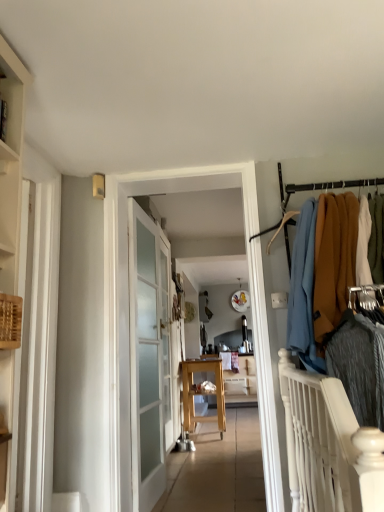
Measure the distance between wooden table at center and camera.

They are 5.89 meters apart.

Where is `matte glass door at center`? matte glass door at center is located at coordinates pyautogui.click(x=127, y=303).

Image resolution: width=384 pixels, height=512 pixels. What do you see at coordinates (127, 303) in the screenshot?
I see `matte glass door at center` at bounding box center [127, 303].

Image resolution: width=384 pixels, height=512 pixels. In order to click on blue woolen sweater at right in this screenshot , I will do `click(321, 273)`.

This screenshot has width=384, height=512. Describe the element at coordinates (328, 446) in the screenshot. I see `white wooden balustrade at lower right` at that location.

Describe the element at coordinates (218, 470) in the screenshot. The width and height of the screenshot is (384, 512). I see `wooden table at center` at that location.

What do you see at coordinates (149, 357) in the screenshot? I see `white frosted glass door at center` at bounding box center [149, 357].

Describe the element at coordinates (202, 393) in the screenshot. I see `wooden table at center` at that location.

Find the location of a particular element. This screenshot has width=384, height=512. wooden table at center is located at coordinates (202, 393).

You are a GUI agent. You are given a task and a screenshot of the screen. Output one action in this format:
    pyautogui.click(x=<x>, y=<y>)
    Task: Click on the wooden table at center
    The width and height of the screenshot is (384, 512).
    Given the screenshot: What is the action you would take?
    pyautogui.click(x=241, y=383)

Is wooden table at center oriented away from wooden table at center?

wooden table at center does not have its back to wooden table at center.

Is wooden table at center a part of wooden table at center?

Actually, wooden table at center is outside wooden table at center.

Is wooden table at center touching wooden table at center?

No, wooden table at center is not beside wooden table at center.

Is the surface of wooden table at center in direct contact with clear glass door at center?

No, wooden table at center is not with clear glass door at center.

Could you tell me if wooden table at center is facing clear glass door at center?

No, wooden table at center does not turn towards clear glass door at center.

Which of these two, wooden table at center or clear glass door at center, is wider?

With larger width is wooden table at center.

Between point (241, 448) and point (171, 435), which one is positioned behind?

Positioned behind is point (171, 435).

I want to click on cabinetry that appears on the left of white frosted glass door at center, so click(11, 164).

Is white frosted glass door at center oriented away from wooden shelf at left?

white frosted glass door at center does not have its back to wooden shelf at left.

Can you tell me how much white frosted glass door at center and wooden shelf at left differ in facing direction?

The angular difference between white frosted glass door at center and wooden shelf at left is 71.8 degrees.

From the image's perspective, is white frosted glass door at center under wooden shelf at left?

Yes, from the image's perspective, white frosted glass door at center is beneath wooden shelf at left.

Considering the positions of objects white wooden balustrade at lower right and wooden shelf at left in the image provided, who is behind, white wooden balustrade at lower right or wooden shelf at left?

wooden shelf at left is more distant.

Is white wooden balustrade at lower right wider or thinner than wooden shelf at left?

In the image, white wooden balustrade at lower right appears to be wider than wooden shelf at left.

From a real-world perspective, does white wooden balustrade at lower right stand above wooden shelf at left?

No, from a real-world perspective, white wooden balustrade at lower right is not on top of wooden shelf at left.

Considering the positions of objects white wooden balustrade at lower right and wooden shelf at left in the image provided, who is more to the left, white wooden balustrade at lower right or wooden shelf at left?

wooden shelf at left is more to the left.

Is white wooden balustrade at lower right closer to camera compared to clear glass door at center?

That is True.

Measure the distance between white wooden balustrade at lower right and clear glass door at center.

white wooden balustrade at lower right and clear glass door at center are 7.87 feet apart from each other.

Between white wooden balustrade at lower right and clear glass door at center, which one has smaller width?

clear glass door at center is thinner.

From the image's perspective, which is above, white wooden balustrade at lower right or clear glass door at center?

white wooden balustrade at lower right is shown above in the image.

From the image's perspective, is blue woolen sweater at right on top of clear glass door at center?

Yes, from the image's perspective, blue woolen sweater at right is on top of clear glass door at center.

From a real-world perspective, is blue woolen sweater at right physically below clear glass door at center?

No, from a real-world perspective, blue woolen sweater at right is not under clear glass door at center.

Based on the photo, considering the relative positions of blue woolen sweater at right and clear glass door at center in the image provided, is blue woolen sweater at right to the left of clear glass door at center from the viewer's perspective?

No.

In terms of width, does blue woolen sweater at right look wider or thinner when compared to clear glass door at center?

Clearly, blue woolen sweater at right has more width compared to clear glass door at center.

Is wooden table at center far from wooden shelf at left?

wooden table at center is far away from wooden shelf at left.

From the image's perspective, which one is positioned higher, wooden table at center or wooden shelf at left?

wooden shelf at left appears higher in the image.

Is wooden table at center in front of or behind wooden shelf at left in the image?

In the image, wooden table at center appears behind wooden shelf at left.

What are the coordinates of `furniture below the wooden table at center (from a real-world perspective)` in the screenshot? It's located at (241, 383).

Where is `screen door above the wooden table at center (from the image's perspective)`? This screenshot has width=384, height=512. screen door above the wooden table at center (from the image's perspective) is located at coordinates (166, 345).

Considering their positions, is wooden table at center positioned closer to clear glass door at center than white frosted glass door at center?

The object closer to clear glass door at center is white frosted glass door at center.

Estimate the real-world distances between objects in this image. Which object is further from blue woolen sweater at right, wooden table at center or wooden table at center?

wooden table at center is positioned further to the anchor blue woolen sweater at right.

Looking at the image, which one is located further to clear glass door at center, blue woolen sweater at right or wooden table at center?

blue woolen sweater at right is positioned further to the anchor clear glass door at center.

Which object lies further to the anchor point clear glass door at center, wooden table at center or matte glass door at center?

matte glass door at center lies further to clear glass door at center than the other object.

From the image, which object appears to be nearer to wooden table at center, blue woolen sweater at right or wooden table at center?

wooden table at center lies closer to wooden table at center than the other object.

Which object lies further to the anchor point clear glass door at center, wooden table at center or wooden shelf at left?

wooden shelf at left lies further to clear glass door at center than the other object.

When comparing their distances from wooden table at center, does white wooden balustrade at lower right or wooden table at center seem closer?

The object closer to wooden table at center is wooden table at center.

Looking at the image, which one is located closer to clear glass door at center, wooden shelf at left or matte glass door at center?

The object closer to clear glass door at center is matte glass door at center.

Where is `cabinetry located between white wooden balustrade at lower right and clear glass door at center in the depth direction`? The height and width of the screenshot is (512, 384). cabinetry located between white wooden balustrade at lower right and clear glass door at center in the depth direction is located at coordinates (11, 164).

The height and width of the screenshot is (512, 384). In order to click on path positioned between blue woolen sweater at right and clear glass door at center from near to far in this screenshot , I will do `click(218, 470)`.

Locate an element on the screen. The width and height of the screenshot is (384, 512). cabinetry positioned between white wooden balustrade at lower right and wooden table at center from near to far is located at coordinates pos(11,164).

Identify the location of path positioned between white wooden balustrade at lower right and wooden table at center from near to far. (218, 470).